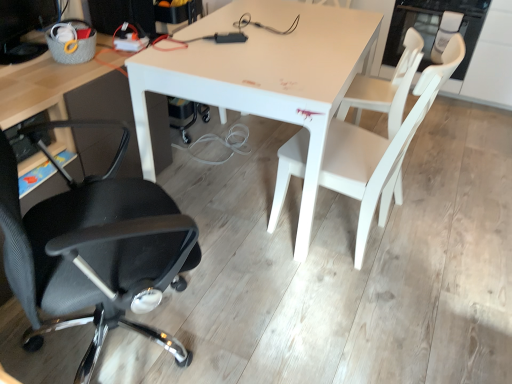
The width and height of the screenshot is (512, 384). I want to click on free region under white matte chair at center, the 2th chair in the left-to-right sequence (from a real-world perspective), so click(343, 231).